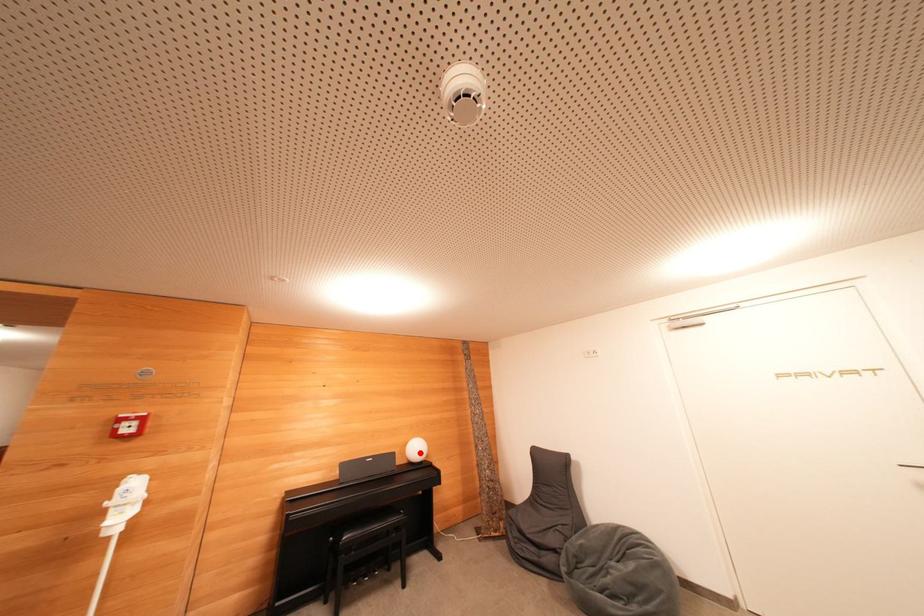
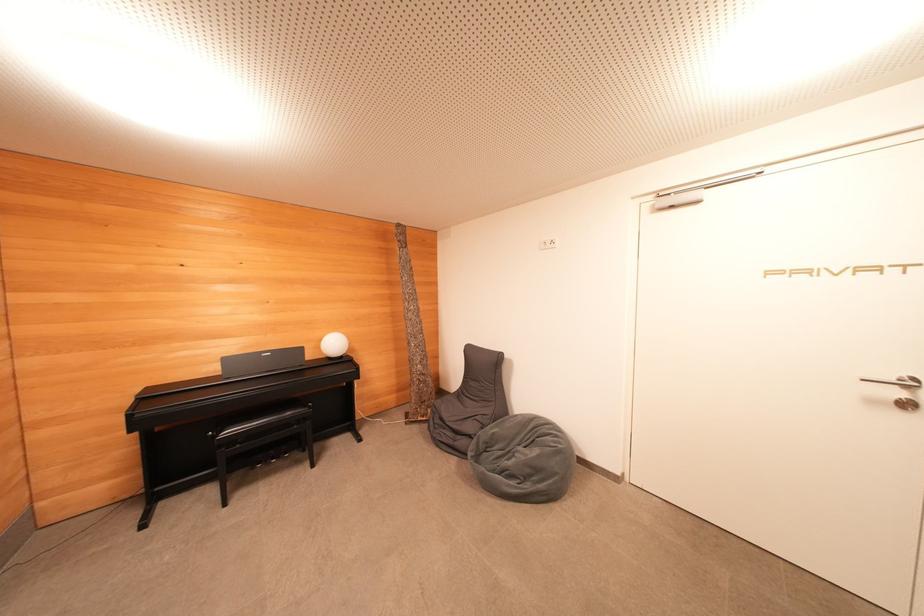
Question: I am providing you with two images of the same scene from different viewpoints. A red point is shown in image1. For the corresponding object point in image2, is it positioned nearer or farther from the camera?

Choices:
 (A) Nearer
 (B) Farther

Answer: (A)